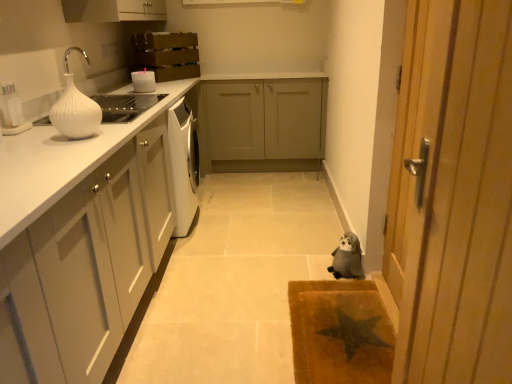
Question: In terms of width, does white glossy knife block at upper left, the 1th appliance positioned from the left, look wider or thinner when compared to beige textured mat at lower right?

Choices:
 (A) thin
 (B) wide

Answer: (A)

Question: Is white glossy knife block at upper left, which ranks as the 1th appliance in front-to-back order, to the left or to the right of beige textured mat at lower right in the image?

Choices:
 (A) right
 (B) left

Answer: (B)

Question: Based on their relative distances, which object is nearer to the white glossy vase at upper left?

Choices:
 (A) wooden door at right
 (B) fluffy gray stuffed animal at lower right
 (C) white glossy knife block at upper left, which ranks as the first appliance in bottom-to-top order
 (D) matte gray cabinets at center, the third cabinetry viewed from the front
 (E) white ribbed vase at left

Answer: (C)

Question: Estimate the real-world distances between objects in this image. Which object is farther from the beige textured mat at lower right?

Choices:
 (A) matte gray cabinets at center, the third cabinetry viewed from the front
 (B) wooden crate at upper center, which appears as the second cabinetry when viewed from the front
 (C) white glossy candle at upper center, the 2th appliance from the front
 (D) fluffy gray stuffed animal at lower right
 (E) white glossy countertop at left

Answer: (B)